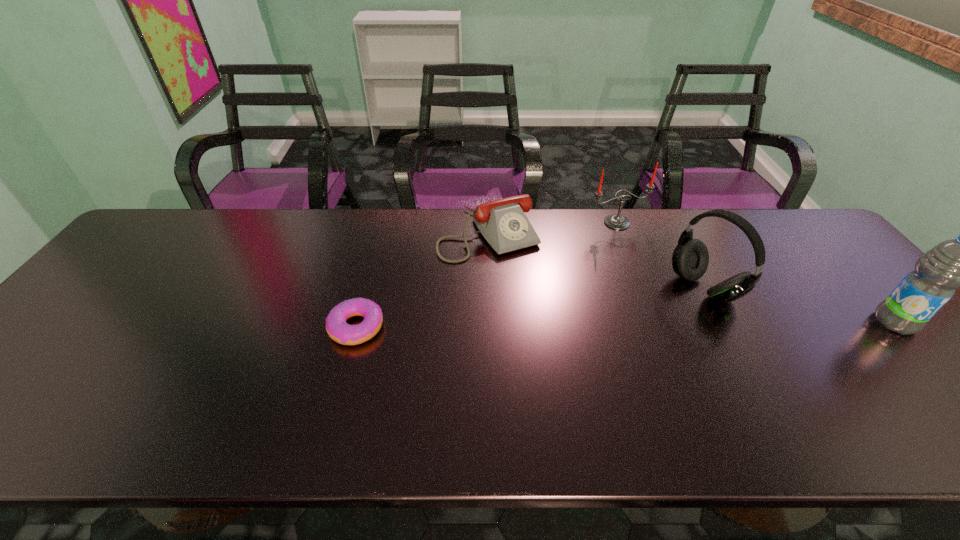
Identify the location of the shortest object. (338, 330).

Where is `the leftmost object`? Image resolution: width=960 pixels, height=540 pixels. the leftmost object is located at coordinates (338, 330).

Where is `water bottle`? The image size is (960, 540). water bottle is located at coordinates [x=958, y=263].

You are a GUI agent. You are given a task and a screenshot of the screen. Output one action in this format:
    pyautogui.click(x=<x>, y=<y>)
    Task: Click on the headset
    
    Given the screenshot: What is the action you would take?
    pyautogui.click(x=690, y=258)

Locate an element on the screen. Image resolution: width=960 pixels, height=540 pixels. telephone is located at coordinates (503, 223).

Locate an element on the screen. the fourth object from right to left is located at coordinates (503, 223).

Locate an element on the screen. This screenshot has height=540, width=960. candle is located at coordinates (614, 221).

Locate an element on the screen. This screenshot has width=960, height=540. vacant area located 0.250m on the right of the doughnut is located at coordinates (484, 327).

Identify the location of vacant space positioned 0.390m on the left of the rightmost object. (720, 322).

The image size is (960, 540). I want to click on vacant position located on the ear cups of the headset, so click(x=644, y=322).